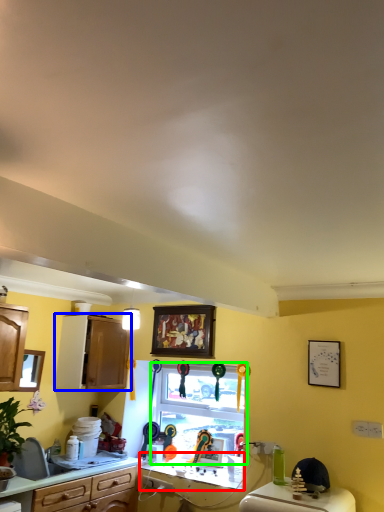
Question: Considering the real-world distances, which object is closest to counter top (highlighted by a red box)? cabinetry (highlighted by a blue box) or window (highlighted by a green box).

Choices:
 (A) cabinetry
 (B) window

Answer: (B)